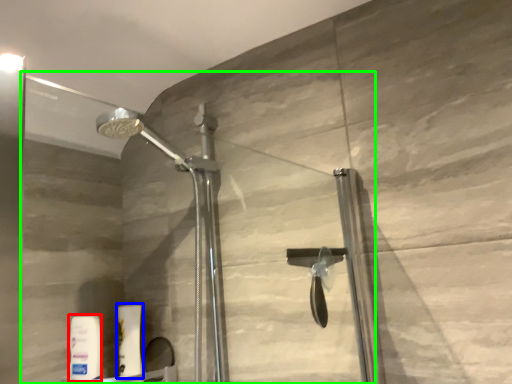
Question: Which object is positioned closest to toiletry (highlighted by a red box)? Select from toiletry (highlighted by a blue box) and glass door (highlighted by a green box).

Choices:
 (A) toiletry
 (B) glass door

Answer: (A)